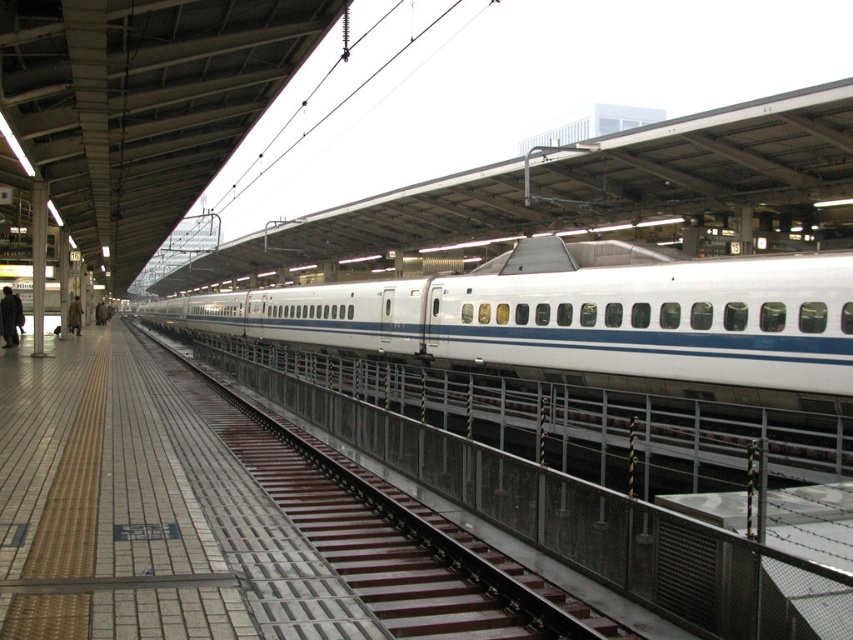
You are standing on the platform and want to board the white smooth passenger train at center. The platform has tactile paving strips along the edge. Where should you stand relative to the tactile paving strips to safely board the train?

You should stand at point (x=584, y=320) relative to the tactile paving strips to safely board the white smooth passenger train at center.

You are a passenger waiting for the train at the platform. You see a dark clothing at platform left and a brown leather coat at left. Which one is closer to the edge of the platform?

The dark clothing at platform left is closer to the edge of the platform because it is in front of the brown leather coat at left, meaning it is positioned nearer to the edge compared to the latter.

You are a traveler waiting on the platform and see the white smooth passenger train at center and the brown leather coat at left. Which object is closer to you as you stand on the platform?

The brown leather coat at left is closer to you because the white smooth passenger train at center is positioned over it, indicating it is further away.